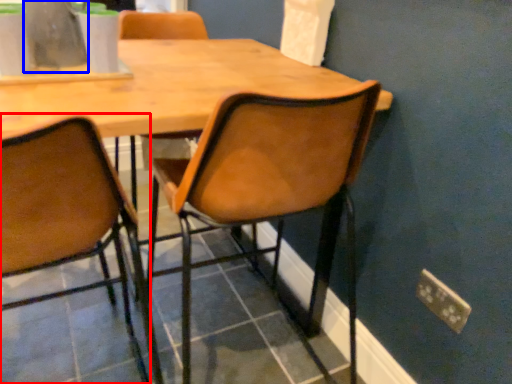
Question: Among these objects, which one is farthest to the camera, chair (highlighted by a red box) or vase (highlighted by a blue box)?

Choices:
 (A) chair
 (B) vase

Answer: (B)